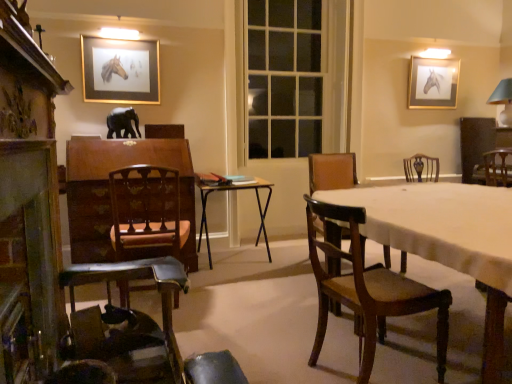
Locate an element on the screen. free space in front of metallic silver table at center is located at coordinates (233, 285).